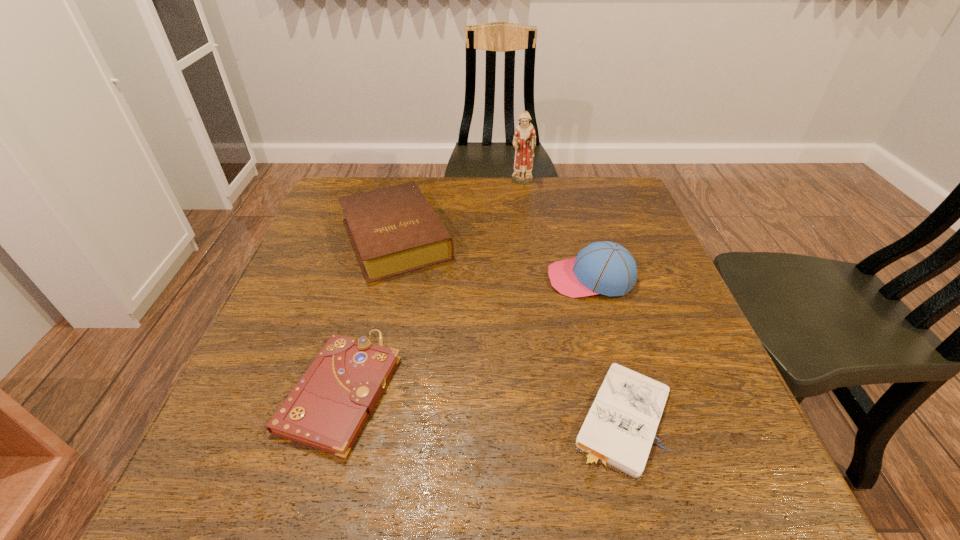
At what (x,y) coordinates should I click in order to perform the action: click on empty space that is in between the farthest object and the right notebook. Please return your answer as a coordinate pair (x, y). This screenshot has width=960, height=540. Looking at the image, I should click on (572, 300).

Image resolution: width=960 pixels, height=540 pixels. Find the location of `object that is the third closest one to the Bible`. object that is the third closest one to the Bible is located at coordinates (603, 267).

Find the location of a particular element. object identified as the fourth closest to the right notebook is located at coordinates (524, 141).

At what (x,y) coordinates should I click in order to perform the action: click on free location that satisfies the following two spatial constraints: 1. on the front-facing side of the tallest object; 2. on the left side of the shorter notebook. Please return your answer as a coordinate pair (x, y). The height and width of the screenshot is (540, 960). Looking at the image, I should click on (555, 417).